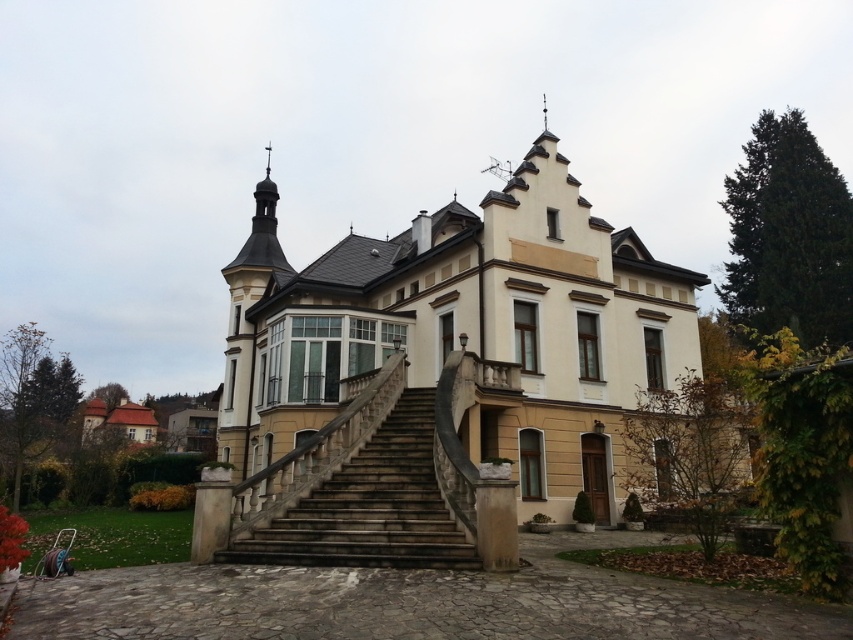
Question: Based on their relative distances, which object is farther from the beige stone mansion at center?

Choices:
 (A) brown shingles at lower left
 (B) brown stone staircase at center

Answer: (A)

Question: Is the position of beige stone mansion at center less distant than that of brown shingles at lower left?

Choices:
 (A) yes
 (B) no

Answer: (A)

Question: Which point is closer to the camera?

Choices:
 (A) beige stone mansion at center
 (B) brown stone staircase at center

Answer: (B)

Question: Can you confirm if beige stone mansion at center is smaller than brown shingles at lower left?

Choices:
 (A) no
 (B) yes

Answer: (A)

Question: Which point is farther to the camera?

Choices:
 (A) brown shingles at lower left
 (B) brown stone staircase at center
 (C) beige stone mansion at center

Answer: (A)

Question: Can you confirm if brown stone staircase at center is positioned below brown shingles at lower left?

Choices:
 (A) yes
 (B) no

Answer: (B)